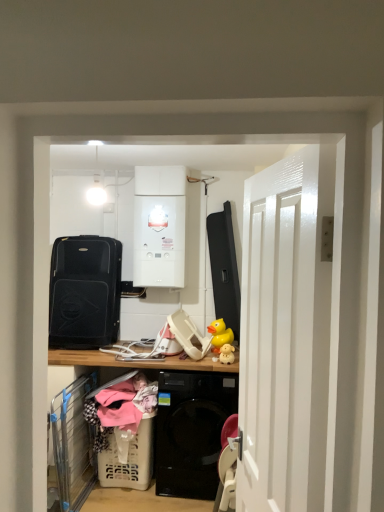
Question: Is black matte suitcase at left, which appears as the first appliance when viewed from the left, wider than white plastic laundry basket at lower left?

Choices:
 (A) yes
 (B) no

Answer: (B)

Question: From a real-world perspective, does black matte suitcase at left, arranged as the 2th appliance when viewed from the right, sit lower than white plastic laundry basket at lower left?

Choices:
 (A) no
 (B) yes

Answer: (A)

Question: Is black matte suitcase at left, arranged as the 2th appliance when viewed from the right, bigger than white plastic laundry basket at lower left?

Choices:
 (A) no
 (B) yes

Answer: (A)

Question: Is black matte suitcase at left, arranged as the 2th appliance when viewed from the right, shorter than white plastic laundry basket at lower left?

Choices:
 (A) yes
 (B) no

Answer: (A)

Question: From a real-world perspective, is black matte suitcase at left, which appears as the first appliance when viewed from the left, on white plastic laundry basket at lower left?

Choices:
 (A) no
 (B) yes

Answer: (B)

Question: Considering the positions of white plastic laundry basket at lower left and white glossy door at right in the image, is white plastic laundry basket at lower left taller or shorter than white glossy door at right?

Choices:
 (A) short
 (B) tall

Answer: (A)

Question: Considering the positions of white plastic laundry basket at lower left and white glossy door at right in the image, is white plastic laundry basket at lower left wider or thinner than white glossy door at right?

Choices:
 (A) wide
 (B) thin

Answer: (A)

Question: Choose the correct answer: Is white plastic laundry basket at lower left inside white glossy door at right or outside it?

Choices:
 (A) inside
 (B) outside

Answer: (B)

Question: In the image, is white plastic laundry basket at lower left on the left side or the right side of white glossy door at right?

Choices:
 (A) right
 (B) left

Answer: (B)

Question: Considering their positions, is white glossy door at right located in front of or behind white glossy boiler at upper center, acting as the first appliance starting from the right?

Choices:
 (A) behind
 (B) front

Answer: (B)

Question: Would you say white glossy door at right is to the left or to the right of white glossy boiler at upper center, which appears as the second appliance when viewed from the left, in the picture?

Choices:
 (A) left
 (B) right

Answer: (B)

Question: Does point (329, 308) appear closer or farther from the camera than point (183, 245)?

Choices:
 (A) farther
 (B) closer

Answer: (B)

Question: Considering the positions of white glossy door at right and white glossy boiler at upper center, which appears as the second appliance when viewed from the left, in the image, is white glossy door at right bigger or smaller than white glossy boiler at upper center, which appears as the second appliance when viewed from the left,?

Choices:
 (A) small
 (B) big

Answer: (B)

Question: From the image's perspective, is white glossy boiler at upper center, acting as the first appliance starting from the right, located above or below yellow rubber duck at center?

Choices:
 (A) above
 (B) below

Answer: (A)

Question: Considering the positions of white glossy boiler at upper center, which appears as the second appliance when viewed from the left, and yellow rubber duck at center in the image, is white glossy boiler at upper center, which appears as the second appliance when viewed from the left, bigger or smaller than yellow rubber duck at center?

Choices:
 (A) big
 (B) small

Answer: (A)